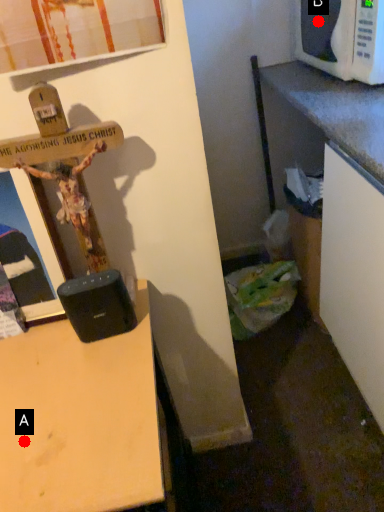
Question: Two points are circled on the image, labeled by A and B beside each circle. Which point is farther from the camera taking this photo?

Choices:
 (A) A is further
 (B) B is further

Answer: (B)